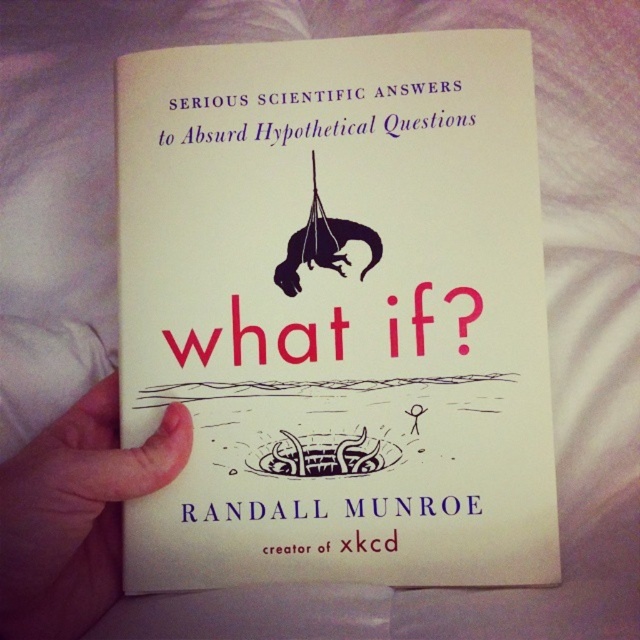
You are a bookshelf organizer who needs to place the white paper book at center and the white skin at lower left on a shelf. According to the image, which object should be placed on the left side of the shelf?

The white skin at lower left should be placed on the left side of the shelf because the white paper book at center is to the right of it in the image.

From the picture: You are an assistant who needs to place the white paper book at center and the white skin at lower left on a shelf. The shelf has a height limit of 10 cm. Can both items be placed on the shelf without exceeding the height limit?

The white paper book at center has a greater height compared to white skin at lower left. If the book exceeds the 10 cm height limit, then the white skin at lower left might still fit, but the book would not. However, if the book is under 10 cm, both could fit. Without specific measurements, it is uncertain.